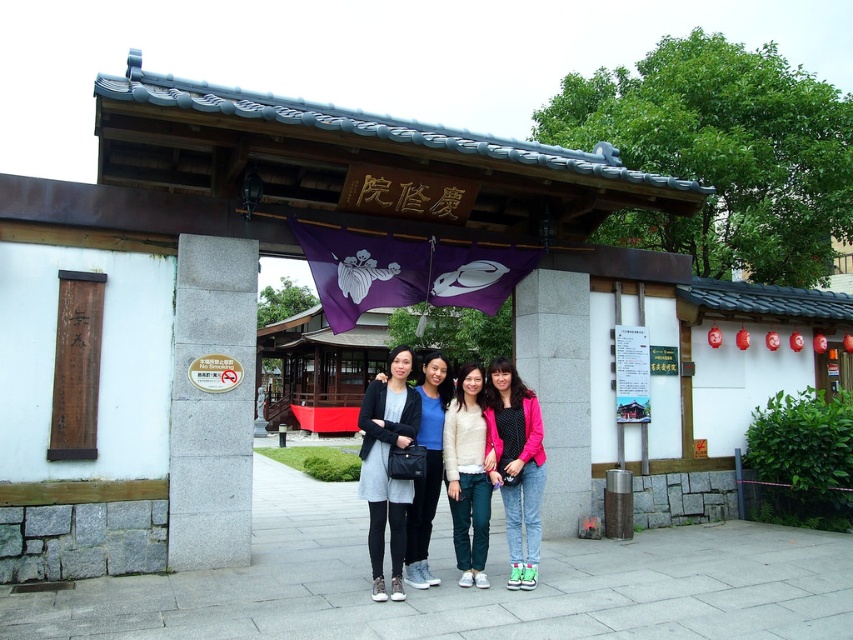
Between pink fabric jacket at center and matte black jacket at center, which one is positioned lower?

pink fabric jacket at center is below.

Consider the image. Can you confirm if pink fabric jacket at center is taller than matte black jacket at center?

No.

Between point (498, 400) and point (410, 564), which one is positioned behind?

Point (498, 400)

Find the location of a particular element. The width and height of the screenshot is (853, 640). pink fabric jacket at center is located at coordinates click(x=515, y=465).

Who is higher up, white cotton sweater at center or matte black jacket at center?

matte black jacket at center

Is white cotton sweater at center bigger than matte black jacket at center?

Correct, white cotton sweater at center is larger in size than matte black jacket at center.

Between point (456, 403) and point (422, 572), which one is positioned behind?

Positioned behind is point (456, 403).

Locate an element on the screen. This screenshot has width=853, height=640. white cotton sweater at center is located at coordinates (468, 474).

Can you confirm if matte black dress at center is taller than white cotton sweater at center?

No, matte black dress at center is not taller than white cotton sweater at center.

Identify the location of matte black dress at center. (386, 465).

Image resolution: width=853 pixels, height=640 pixels. I want to click on matte black dress at center, so click(386, 465).